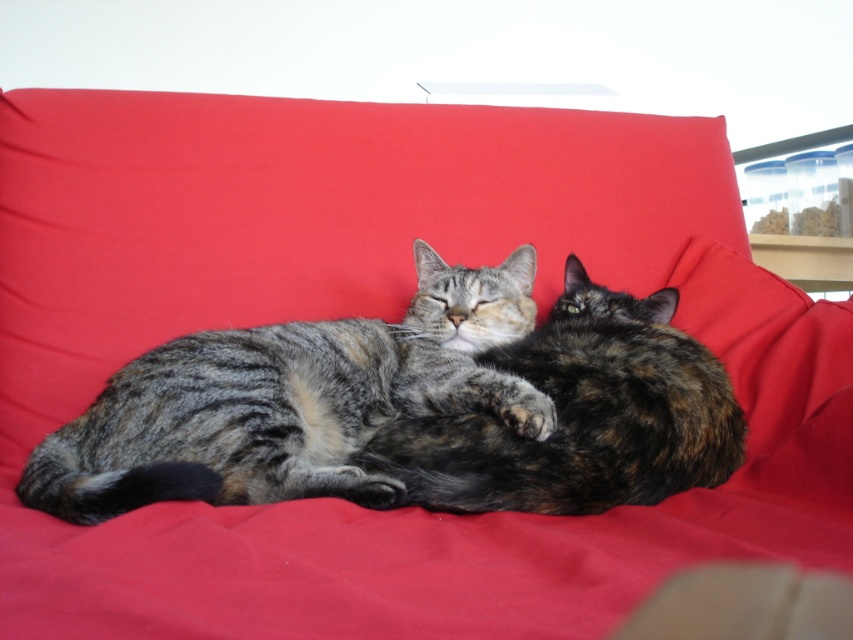
Question: Which of the following is the closest to the observer?

Choices:
 (A) tap(674, 355)
 (B) tap(260, 388)

Answer: (B)

Question: Which object appears closest to the camera in this image?

Choices:
 (A) tabby fur cat at center
 (B) gray tabby cat at center

Answer: (B)

Question: Is gray tabby cat at center above tabby fur cat at center?

Choices:
 (A) yes
 (B) no

Answer: (B)

Question: From the image, what is the correct spatial relationship of gray tabby cat at center in relation to tabby fur cat at center?

Choices:
 (A) right
 (B) left

Answer: (B)

Question: Is gray tabby cat at center wider than tabby fur cat at center?

Choices:
 (A) yes
 (B) no

Answer: (A)